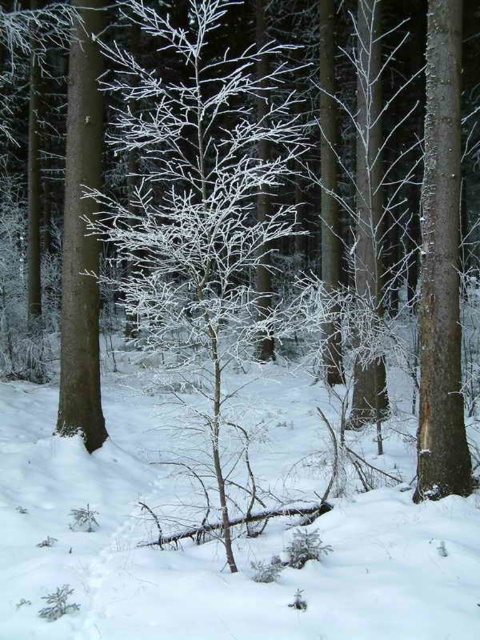
You are standing in the winter forest scene. You want to place a small decorative snowman exactly at the center of the white frosty snow at center. Where should you position the snowman?

The snowman should be placed at the coordinates point (x=215, y=544) as specified in the white frosty snow at center description.

You are an animal trying to cross the white frosty snow at center. There is a frosted white tree at center nearby. Which path is wider for you to move through?

The frosted white tree at center has a greater width than the white frosty snow at center, so the path around the frosted white tree at center would be wider for you to move through.